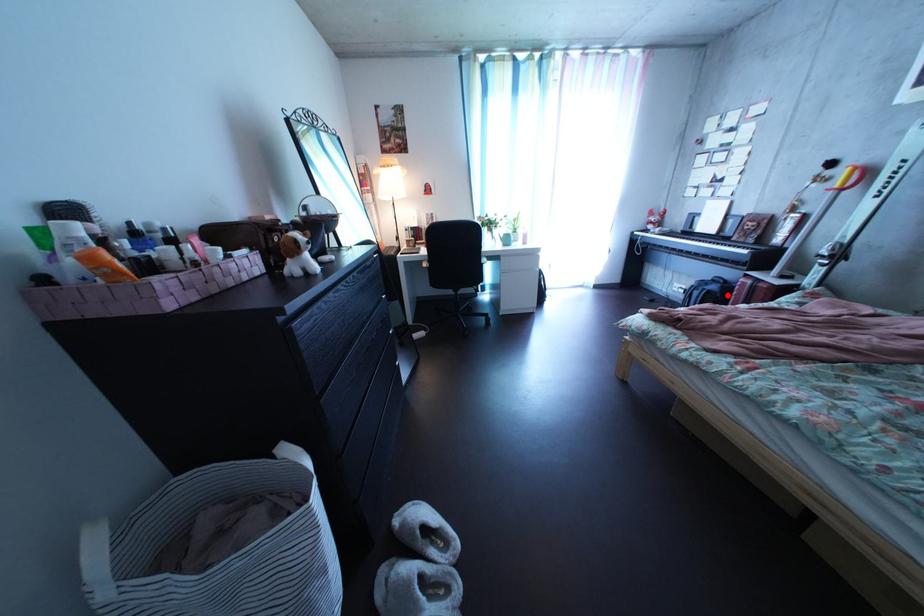
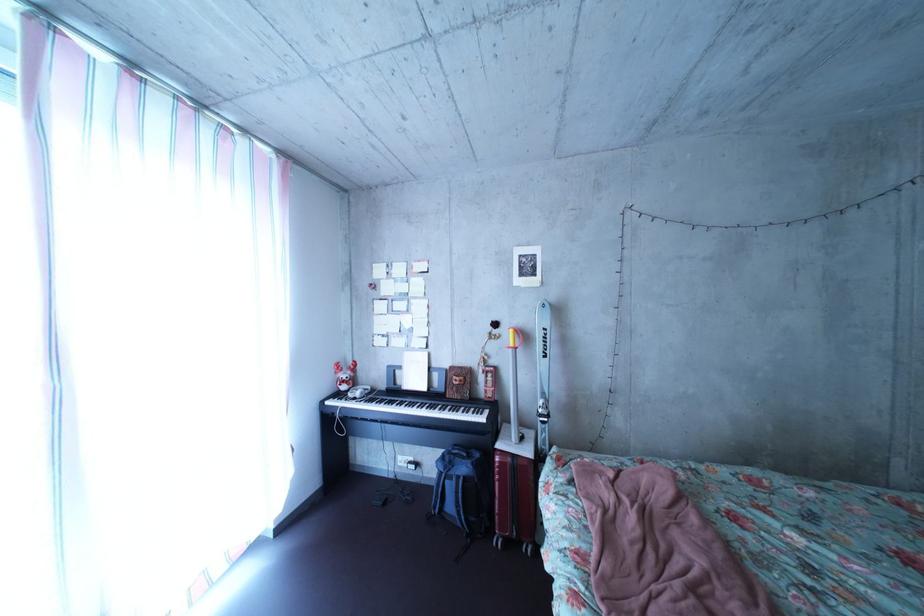
Question: I am providing you with two images of the same scene from different viewpoints. A red point is shown in image1. For the corresponding object point in image2, is it positioned nearer or farther from the camera?

Choices:
 (A) Nearer
 (B) Farther

Answer: (B)